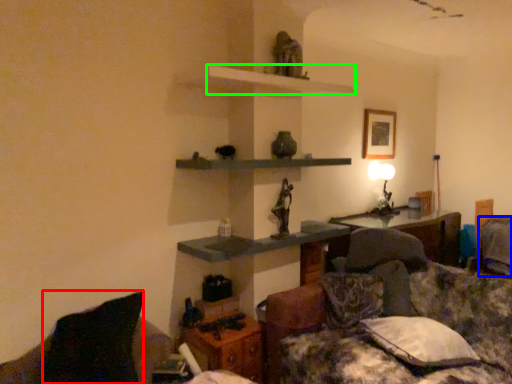
Question: Estimate the real-world distances between objects in this image. Which object is closer to pillow (highlighted by a red box), pillow (highlighted by a blue box) or shelf (highlighted by a green box)?

Choices:
 (A) pillow
 (B) shelf

Answer: (B)